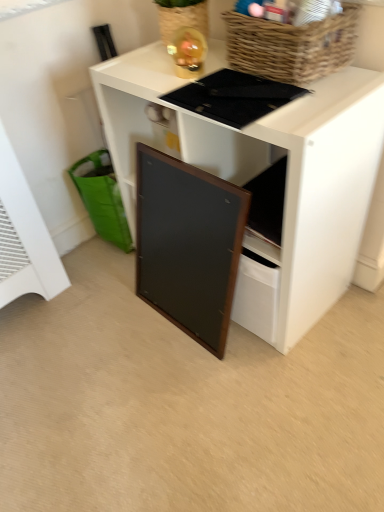
What is the approximate height of black matte board at center?

The height of black matte board at center is 30.63 inches.

You are a GUI agent. You are given a task and a screenshot of the screen. Output one action in this format:
    pyautogui.click(x=<x>, y=<y>)
    Task: Click on the green fabric shopping basket at lower left
    Image resolution: width=384 pixels, height=512 pixels.
    Given the screenshot: What is the action you would take?
    pyautogui.click(x=102, y=198)

Locate an element on the screen. The height and width of the screenshot is (512, 384). wooden framed board at center is located at coordinates (188, 245).

The width and height of the screenshot is (384, 512). Identify the location of black matte board at center. (265, 168).

Which object is positioned more to the left, black matte board at center or woven brown basket at upper right?

black matte board at center is more to the left.

Which of these two, black matte board at center or woven brown basket at upper right, is smaller?

woven brown basket at upper right.

Where is `desk that appears behind the woven brown basket at upper right`? desk that appears behind the woven brown basket at upper right is located at coordinates (265, 168).

Is woven brown basket at upper right positioned far away from green fabric shopping basket at lower left?

No.

This screenshot has height=512, width=384. Identify the location of basket above the green fabric shopping basket at lower left (from a real-world perspective). (291, 46).

Which is nearer, (288, 76) or (113, 185)?

Point (288, 76) is positioned closer to the camera compared to point (113, 185).

How different are the orientations of woven brown basket at upper right and green fabric shopping basket at lower left in degrees?

9.06 degrees.

How different are the orientations of black matte board at center and wooden framed board at center in degrees?

The angular difference between black matte board at center and wooden framed board at center is 0.151 degrees.

Measure the distance between black matte board at center and wooden framed board at center.

19.65 centimeters.

Is black matte board at center to the left of wooden framed board at center from the viewer's perspective?

Incorrect, black matte board at center is not on the left side of wooden framed board at center.

Would you say black matte board at center is inside or outside wooden framed board at center?

black matte board at center lies outside wooden framed board at center.

Is green fabric shopping basket at lower left to the right of woven brown basket at upper right from the viewer's perspective?

No, green fabric shopping basket at lower left is not to the right of woven brown basket at upper right.

From a real-world perspective, is green fabric shopping basket at lower left under woven brown basket at upper right?

Correct, in the physical world, green fabric shopping basket at lower left is lower than woven brown basket at upper right.

Is green fabric shopping basket at lower left not close to woven brown basket at upper right?

That's not correct — green fabric shopping basket at lower left is a little close to woven brown basket at upper right.

Is green fabric shopping basket at lower left wider than woven brown basket at upper right?

Yes, green fabric shopping basket at lower left is wider than woven brown basket at upper right.

Considering the relative sizes of woven brown basket at upper right and wooden framed board at center in the image provided, is woven brown basket at upper right thinner than wooden framed board at center?

No.

How far apart are woven brown basket at upper right and wooden framed board at center?

woven brown basket at upper right and wooden framed board at center are 19.11 inches apart from each other.

Considering the sizes of woven brown basket at upper right and wooden framed board at center in the image, is woven brown basket at upper right bigger or smaller than wooden framed board at center?

woven brown basket at upper right is smaller than wooden framed board at center.

Consider the image. Is woven brown basket at upper right inside or outside of wooden framed board at center?

woven brown basket at upper right cannot be found inside wooden framed board at center.

Considering the relative sizes of green fabric shopping basket at lower left and wooden framed board at center in the image provided, is green fabric shopping basket at lower left smaller than wooden framed board at center?

Indeed, green fabric shopping basket at lower left has a smaller size compared to wooden framed board at center.

Is green fabric shopping basket at lower left aimed at wooden framed board at center?

No.

Are green fabric shopping basket at lower left and wooden framed board at center beside each other?

No, green fabric shopping basket at lower left is not next to wooden framed board at center.

From the picture: How many degrees apart are the facing directions of wooden framed board at center and black matte board at center?

The facing directions of wooden framed board at center and black matte board at center are 0.151 degrees apart.

Considering the relative sizes of wooden framed board at center and black matte board at center in the image provided, is wooden framed board at center smaller than black matte board at center?

Indeed, wooden framed board at center has a smaller size compared to black matte board at center.

Can you confirm if wooden framed board at center is shorter than black matte board at center?

Yes, wooden framed board at center is shorter than black matte board at center.

Is wooden framed board at center at the left side of black matte board at center?

Yes.

Locate an element on the screen. desk behind the woven brown basket at upper right is located at coordinates (265, 168).

At what (x,y) coordinates should I click in order to perform the action: click on shopping basket located on the left of woven brown basket at upper right. Please return your answer as a coordinate pair (x, y). The height and width of the screenshot is (512, 384). Looking at the image, I should click on (102, 198).

Which object lies nearer to the anchor point green fabric shopping basket at lower left, black matte board at center or woven brown basket at upper right?

black matte board at center is closer to green fabric shopping basket at lower left.

When comparing their distances from black matte board at center, does green fabric shopping basket at lower left or woven brown basket at upper right seem further?

Among the two, green fabric shopping basket at lower left is located further to black matte board at center.

When comparing their distances from green fabric shopping basket at lower left, does wooden framed board at center or woven brown basket at upper right seem further?

woven brown basket at upper right is positioned further to the anchor green fabric shopping basket at lower left.

From the image, which object appears to be farther from black matte board at center, woven brown basket at upper right or green fabric shopping basket at lower left?

green fabric shopping basket at lower left is further to black matte board at center.

When comparing their distances from woven brown basket at upper right, does black matte board at center or green fabric shopping basket at lower left seem closer?

The object closer to woven brown basket at upper right is black matte board at center.

Considering their positions, is green fabric shopping basket at lower left positioned closer to wooden framed board at center than woven brown basket at upper right?

The object closer to wooden framed board at center is green fabric shopping basket at lower left.

Estimate the real-world distances between objects in this image. Which object is further from wooden framed board at center, black matte board at center or green fabric shopping basket at lower left?

green fabric shopping basket at lower left lies further to wooden framed board at center than the other object.

Which object lies further to the anchor point woven brown basket at upper right, green fabric shopping basket at lower left or wooden framed board at center?

green fabric shopping basket at lower left lies further to woven brown basket at upper right than the other object.

Identify the location of desk located between woven brown basket at upper right and green fabric shopping basket at lower left in the depth direction. (265, 168).

Locate an element on the screen. This screenshot has width=384, height=512. desk between woven brown basket at upper right and wooden framed board at center from top to bottom is located at coordinates (265, 168).

You are a GUI agent. You are given a task and a screenshot of the screen. Output one action in this format:
    pyautogui.click(x=<x>, y=<y>)
    Task: Click on the cabinetry located between woven brown basket at upper right and green fabric shopping basket at lower left in the depth direction
    The height and width of the screenshot is (512, 384).
    Given the screenshot: What is the action you would take?
    pyautogui.click(x=188, y=245)

Locate an element on the screen. This screenshot has width=384, height=512. cabinetry between black matte board at center and green fabric shopping basket at lower left from front to back is located at coordinates (188, 245).